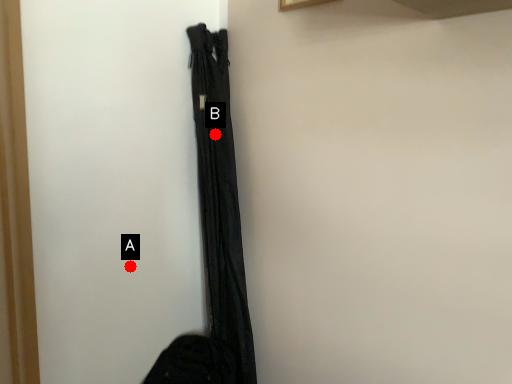
Question: Two points are circled on the image, labeled by A and B beside each circle. Which point is closer to the camera?

Choices:
 (A) A is closer
 (B) B is closer

Answer: (A)